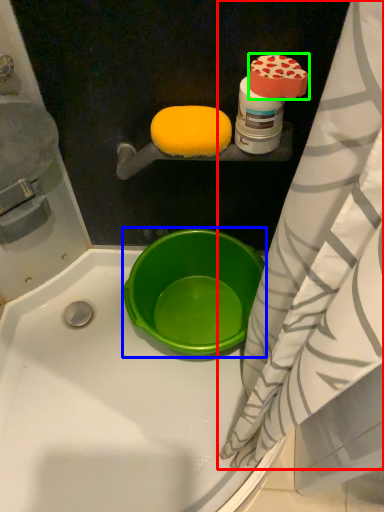
Question: Which object is positioned closest to curtain (highlighted by a red box)? Select from basin (highlighted by a blue box) and food (highlighted by a green box).

Choices:
 (A) basin
 (B) food

Answer: (A)